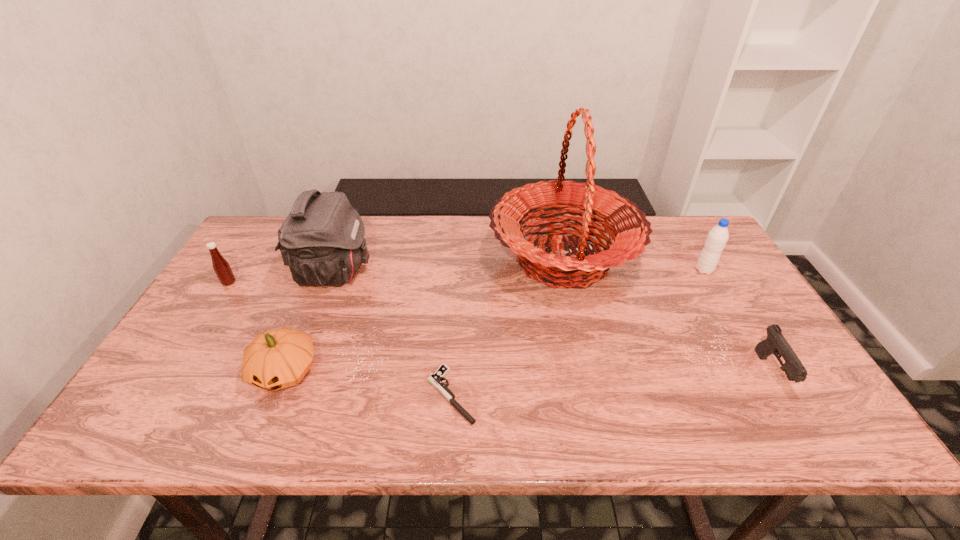
This screenshot has width=960, height=540. What are the coordinates of `basket` in the screenshot? It's located at (629, 228).

Image resolution: width=960 pixels, height=540 pixels. I want to click on the tallest object, so click(x=629, y=228).

Find the location of a particular element. The height and width of the screenshot is (540, 960). shoulder bag is located at coordinates (322, 241).

The image size is (960, 540). Identify the location of water bottle. (717, 238).

The height and width of the screenshot is (540, 960). I want to click on Tabasco sauce, so click(221, 267).

Locate an element on the screen. Image resolution: width=960 pixels, height=540 pixels. gourd is located at coordinates (276, 359).

Where is `the second shortest object`? Image resolution: width=960 pixels, height=540 pixels. the second shortest object is located at coordinates (776, 344).

This screenshot has width=960, height=540. I want to click on the right pistol, so click(776, 344).

Find the location of a particular element. The width and height of the screenshot is (960, 540). the shorter pistol is located at coordinates (435, 379).

The height and width of the screenshot is (540, 960). Find the location of `the left pistol`. the left pistol is located at coordinates (435, 379).